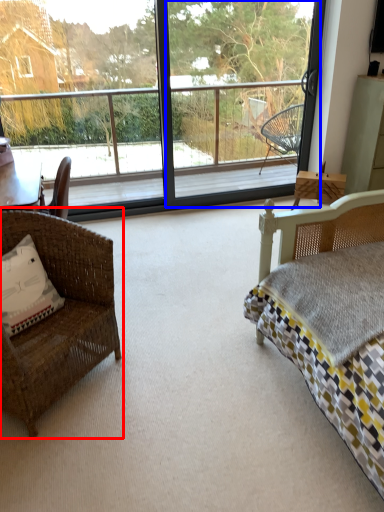
Question: Among these objects, which one is nearest to the camera, chair (highlighted by a red box) or screen door (highlighted by a blue box)?

Choices:
 (A) chair
 (B) screen door

Answer: (A)